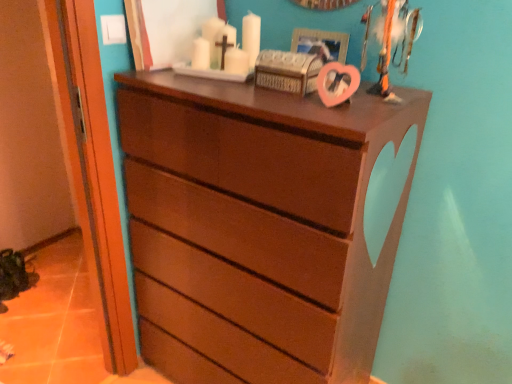
Question: Is metallic silver trophy at upper right smaller than matte brown chest of drawers at center?

Choices:
 (A) no
 (B) yes

Answer: (B)

Question: Considering the relative sizes of metallic silver trophy at upper right and matte brown chest of drawers at center in the image provided, is metallic silver trophy at upper right bigger than matte brown chest of drawers at center?

Choices:
 (A) no
 (B) yes

Answer: (A)

Question: Is metallic silver trophy at upper right positioned before matte brown chest of drawers at center?

Choices:
 (A) no
 (B) yes

Answer: (A)

Question: Can you confirm if metallic silver trophy at upper right is positioned to the right of matte brown chest of drawers at center?

Choices:
 (A) no
 (B) yes

Answer: (B)

Question: Considering the relative sizes of metallic silver trophy at upper right and matte brown chest of drawers at center in the image provided, is metallic silver trophy at upper right wider than matte brown chest of drawers at center?

Choices:
 (A) no
 (B) yes

Answer: (A)

Question: Is metallic silver trophy at upper right oriented towards matte brown chest of drawers at center?

Choices:
 (A) yes
 (B) no

Answer: (B)

Question: Is pink matte picture frame at upper center positioned with its back to matte brown chest of drawers at center?

Choices:
 (A) yes
 (B) no

Answer: (B)

Question: From a real-world perspective, is pink matte picture frame at upper center physically above matte brown chest of drawers at center?

Choices:
 (A) no
 (B) yes

Answer: (B)

Question: Is pink matte picture frame at upper center thinner than matte brown chest of drawers at center?

Choices:
 (A) yes
 (B) no

Answer: (A)

Question: From the image's perspective, is pink matte picture frame at upper center under matte brown chest of drawers at center?

Choices:
 (A) yes
 (B) no

Answer: (B)

Question: From the image's perspective, is pink matte picture frame at upper center located above matte brown chest of drawers at center?

Choices:
 (A) yes
 (B) no

Answer: (A)

Question: Is matte brown chest of drawers at center completely or partially inside pink matte picture frame at upper center?

Choices:
 (A) no
 (B) yes

Answer: (A)

Question: Considering the relative positions of pink matte picture frame at upper center and matte wood door at left in the image provided, is pink matte picture frame at upper center to the left of matte wood door at left from the viewer's perspective?

Choices:
 (A) yes
 (B) no

Answer: (B)